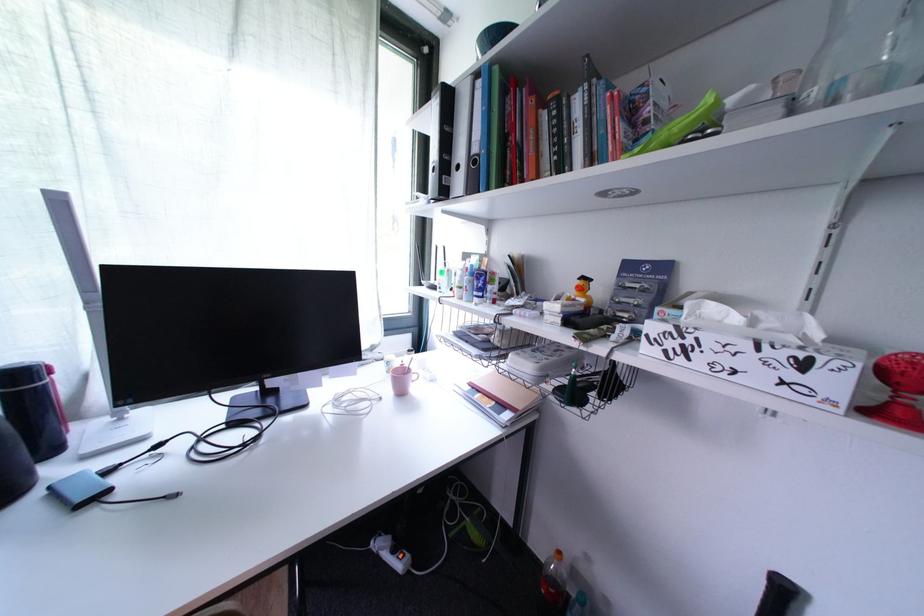
Where is `red spring toy`? The height and width of the screenshot is (616, 924). red spring toy is located at coordinates (898, 391).